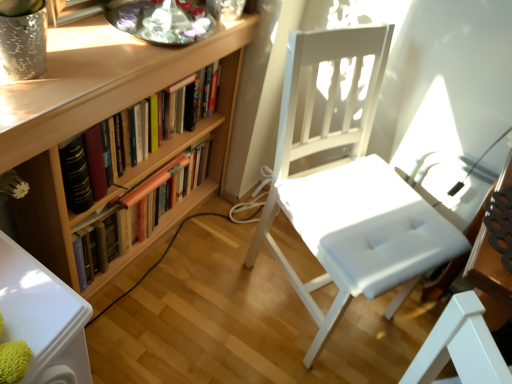
Question: Is wooden bookshelf at left, the second book ordered from the bottom, aimed at white leather chair at center?

Choices:
 (A) no
 (B) yes

Answer: (B)

Question: Is wooden bookshelf at left, the first book positioned from the top, further to camera compared to white leather chair at center?

Choices:
 (A) no
 (B) yes

Answer: (B)

Question: Is wooden bookshelf at left, the first book positioned from the top, looking in the opposite direction of white leather chair at center?

Choices:
 (A) yes
 (B) no

Answer: (B)

Question: Is wooden bookshelf at left, the first book positioned from the top, positioned beyond the bounds of white leather chair at center?

Choices:
 (A) no
 (B) yes

Answer: (B)

Question: Can you confirm if wooden bookshelf at left, the second book ordered from the bottom, is bigger than white leather chair at center?

Choices:
 (A) yes
 (B) no

Answer: (B)

Question: Considering the relative sizes of wooden bookshelf at left, the first book positioned from the top, and white leather chair at center in the image provided, is wooden bookshelf at left, the first book positioned from the top, wider than white leather chair at center?

Choices:
 (A) no
 (B) yes

Answer: (A)

Question: Can you confirm if white leather chair at center is bigger than wooden bookshelf at left, the second book ordered from the bottom?

Choices:
 (A) no
 (B) yes

Answer: (B)

Question: Could you tell me if white leather chair at center is facing wooden bookshelf at left, the second book ordered from the bottom?

Choices:
 (A) no
 (B) yes

Answer: (A)

Question: From the image's perspective, is white leather chair at center under wooden bookshelf at left, the first book positioned from the top?

Choices:
 (A) no
 (B) yes

Answer: (B)

Question: Is white leather chair at center at the left side of wooden bookshelf at left, the first book positioned from the top?

Choices:
 (A) no
 (B) yes

Answer: (A)

Question: Is white leather chair at center further to the viewer compared to wooden bookshelf at left, the first book positioned from the top?

Choices:
 (A) yes
 (B) no

Answer: (B)

Question: From the image's perspective, is white leather chair at center located above wooden bookshelf at left, the first book positioned from the top?

Choices:
 (A) no
 (B) yes

Answer: (A)

Question: Can wooden bookshelf at left, the 1th book positioned from the bottom, be found inside wooden bookshelf at left, the second book ordered from the bottom?

Choices:
 (A) yes
 (B) no

Answer: (B)